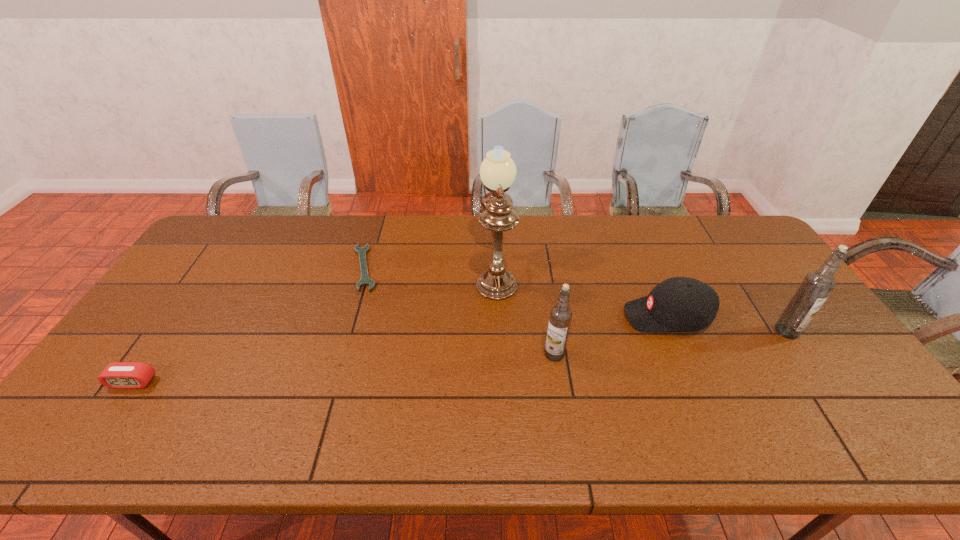
This screenshot has width=960, height=540. I want to click on vacant place for an extra vodka on the left, so [297, 380].